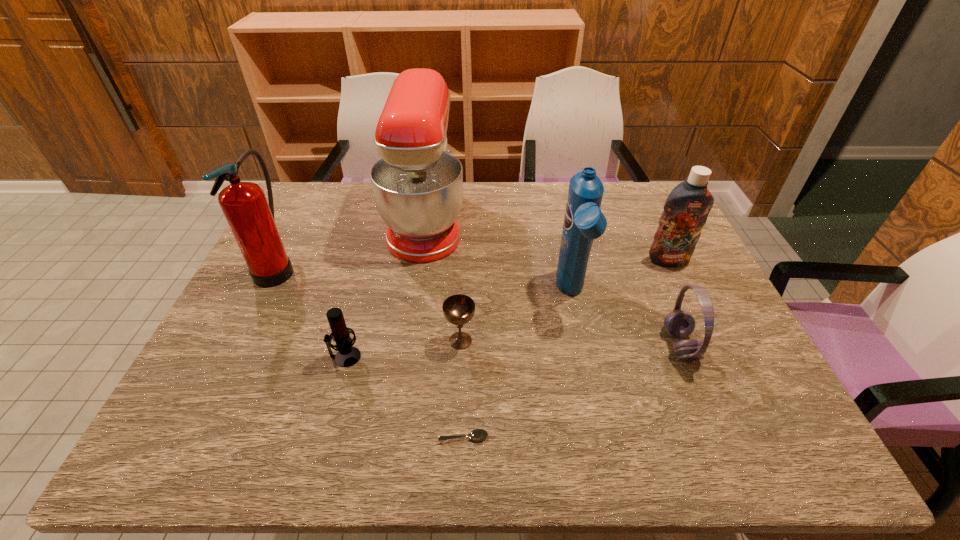
Identify the location of the shortest object. (478, 434).

Identify the location of free space located on the front-facing side of the mixer. The height and width of the screenshot is (540, 960). [561, 222].

The height and width of the screenshot is (540, 960). I want to click on free space located on the front of the leftmost object, so click(x=217, y=386).

Locate an element on the screen. vacant space located 0.300m on the back of the sixth object from left to right is located at coordinates (553, 210).

Image resolution: width=960 pixels, height=540 pixels. I want to click on blank area located 0.350m on the front label of the right shampoo, so click(720, 368).

This screenshot has width=960, height=540. Identify the location of vacant space located 0.150m on the headband and ear cups of the headset. (604, 346).

Where is `free point located 0.090m on the headband and ear cups of the headset`? free point located 0.090m on the headband and ear cups of the headset is located at coordinates (628, 346).

Where is `free location located on the headband and ear cups of the headset`? This screenshot has width=960, height=540. free location located on the headband and ear cups of the headset is located at coordinates (604, 346).

Where is `vacant area situated on the left of the microphone`? vacant area situated on the left of the microphone is located at coordinates point(297,357).

Find the location of `vacant space situated on the left of the chalice`. vacant space situated on the left of the chalice is located at coordinates (331, 341).